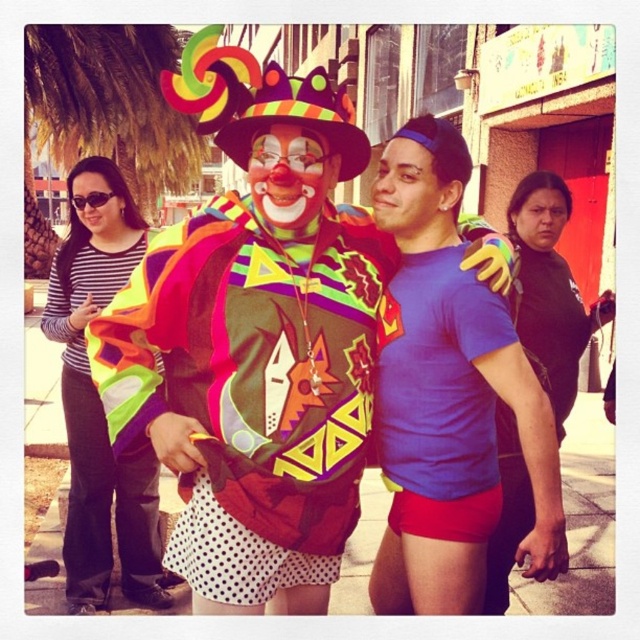
Who is taller, blue matte t-shirt at center or matte clown face at center?

Standing taller between the two is blue matte t-shirt at center.

Is point (532, 410) in front of point (278, 193)?

No, it is behind (278, 193).

The image size is (640, 640). I want to click on blue matte t-shirt at center, so click(x=454, y=355).

Does point (381, 456) come closer to viewer compared to point (161, 541)?

Yes.

The width and height of the screenshot is (640, 640). What are the coordinates of `blue matte t-shirt at center` in the screenshot? It's located at (454, 355).

Consider the image. Can you confirm if matte clown costume at center is positioned above blue matte t-shirt at center?

Yes, matte clown costume at center is above blue matte t-shirt at center.

Based on the photo, does matte clown costume at center come in front of blue matte t-shirt at center?

That is True.

This screenshot has height=640, width=640. Describe the element at coordinates (250, 392) in the screenshot. I see `matte clown costume at center` at that location.

You are a GUI agent. You are given a task and a screenshot of the screen. Output one action in this format:
    pyautogui.click(x=<x>, y=<y>)
    Task: Click on the matte clown costume at center
    This screenshot has width=640, height=640.
    Given the screenshot: What is the action you would take?
    pyautogui.click(x=250, y=392)